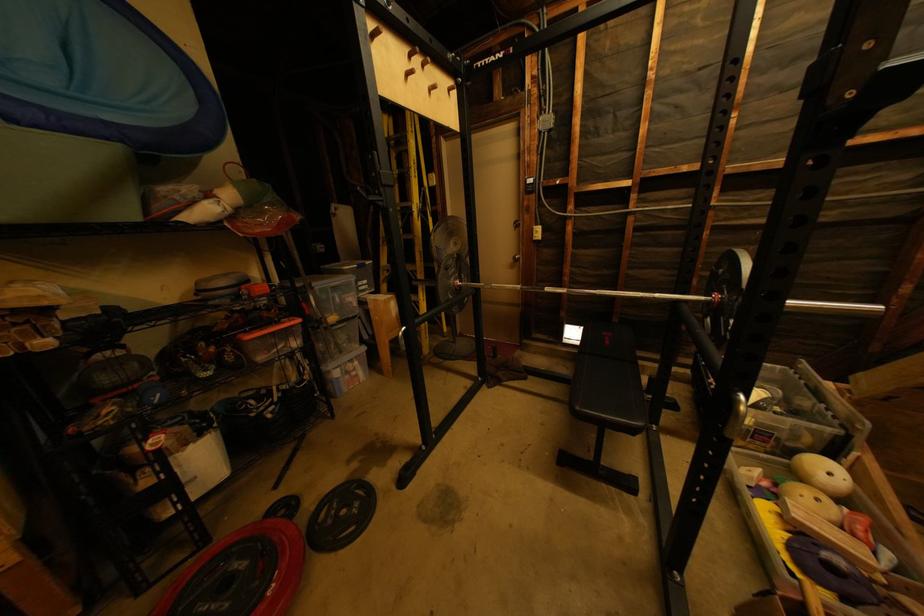
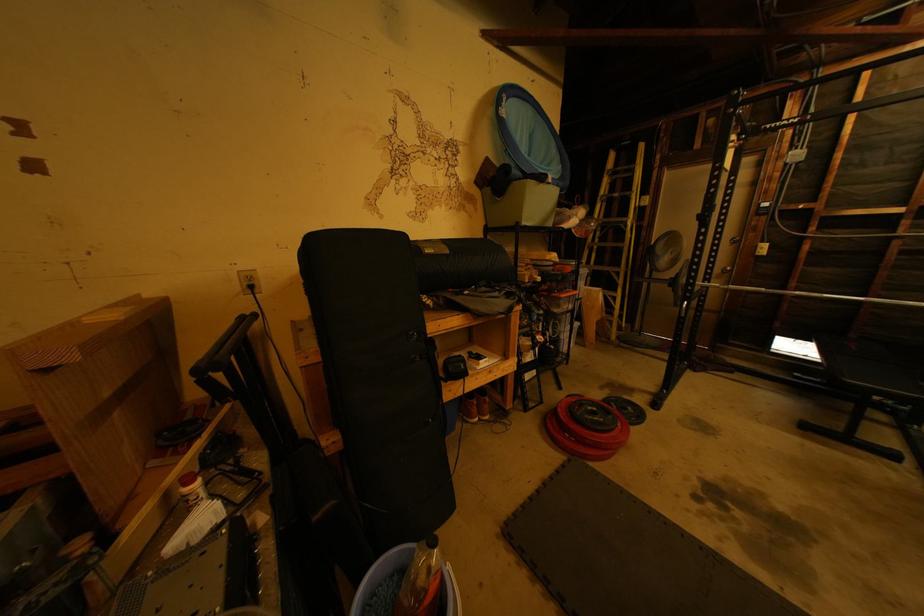
The images are taken continuously from a first-person perspective. In which direction are you moving?

The movement direction of the cameraman is left, backward.